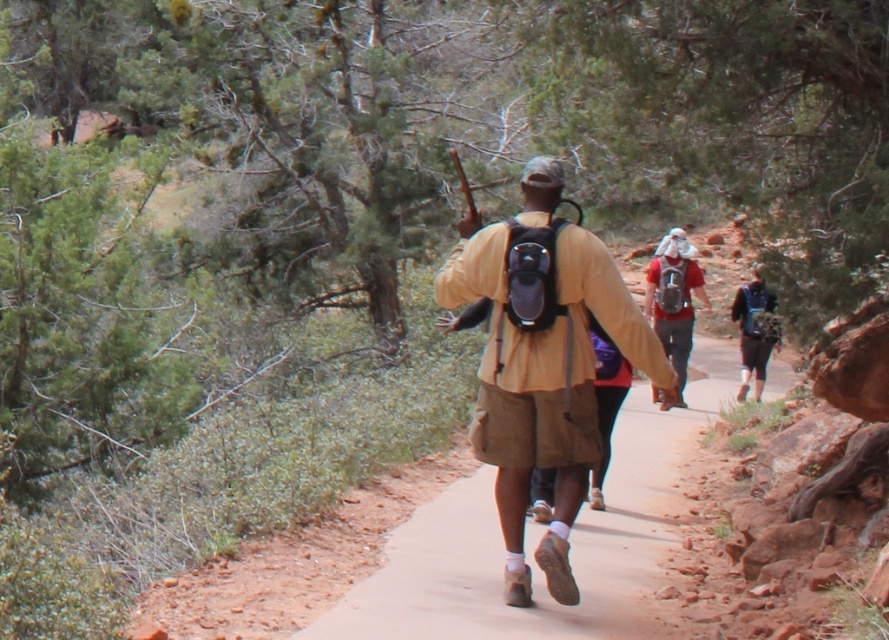
Is point (651, 595) positioned before point (675, 291)?

Yes, it is in front of point (675, 291).

Who is more forward, (411,596) or (666,273)?

Point (411,596)

Locate an element on the screen. brown dirt path at center is located at coordinates (569, 540).

Can you confirm if matte khaki shirt at center is thinner than matte blue backpack at center?

Incorrect, matte khaki shirt at center's width is not less than matte blue backpack at center's.

Does matte khaki shirt at center appear under matte blue backpack at center?

Yes, matte khaki shirt at center is below matte blue backpack at center.

The width and height of the screenshot is (889, 640). I want to click on matte khaki shirt at center, so click(542, 362).

Can you confirm if matte khaki shirt at center is positioned above matte black backpack at center?

Incorrect, matte khaki shirt at center is not positioned above matte black backpack at center.

Can you confirm if matte khaki shirt at center is shorter than matte black backpack at center?

No.

Is point (575, 381) in front of point (669, 282)?

Yes, point (575, 381) is in front of point (669, 282).

This screenshot has height=640, width=889. In order to click on matte khaki shirt at center in this screenshot , I will do `click(542, 362)`.